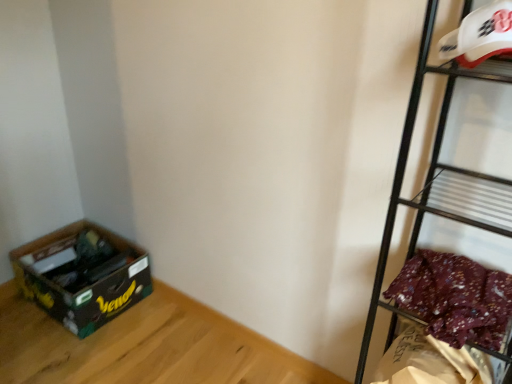
Question: Is white plastic helmet at upper right, marked as the 1th shelf in a top-to-bottom arrangement, located outside matte black box at lower left?

Choices:
 (A) yes
 (B) no

Answer: (A)

Question: From the image's perspective, is white plastic helmet at upper right, marked as the 1th shelf in a top-to-bottom arrangement, under matte black box at lower left?

Choices:
 (A) yes
 (B) no

Answer: (B)

Question: Considering the relative sizes of white plastic helmet at upper right, marked as the 2th shelf in a bottom-to-top arrangement, and matte black box at lower left in the image provided, is white plastic helmet at upper right, marked as the 2th shelf in a bottom-to-top arrangement, thinner than matte black box at lower left?

Choices:
 (A) no
 (B) yes

Answer: (B)

Question: Is white plastic helmet at upper right, marked as the 1th shelf in a top-to-bottom arrangement, looking in the opposite direction of matte black box at lower left?

Choices:
 (A) yes
 (B) no

Answer: (B)

Question: From the image's perspective, does white plastic helmet at upper right, marked as the 2th shelf in a bottom-to-top arrangement, appear higher than matte black box at lower left?

Choices:
 (A) no
 (B) yes

Answer: (B)

Question: Does white plastic helmet at upper right, marked as the 1th shelf in a top-to-bottom arrangement, contain matte black box at lower left?

Choices:
 (A) yes
 (B) no

Answer: (B)

Question: Is matte black box at lower left facing towards green cardboard box at lower left?

Choices:
 (A) no
 (B) yes

Answer: (A)

Question: From a real-world perspective, is matte black box at lower left under green cardboard box at lower left?

Choices:
 (A) no
 (B) yes

Answer: (B)

Question: Does matte black box at lower left have a larger size compared to green cardboard box at lower left?

Choices:
 (A) no
 (B) yes

Answer: (A)

Question: Can you confirm if matte black box at lower left is taller than green cardboard box at lower left?

Choices:
 (A) no
 (B) yes

Answer: (A)

Question: Is the position of matte black box at lower left less distant than that of green cardboard box at lower left?

Choices:
 (A) no
 (B) yes

Answer: (B)

Question: Is matte black box at lower left directly adjacent to green cardboard box at lower left?

Choices:
 (A) yes
 (B) no

Answer: (B)

Question: Does matte black box at lower left have a larger size compared to metallic black shelf at right, which appears as the 1th shelf when ordered from the bottom?

Choices:
 (A) yes
 (B) no

Answer: (B)